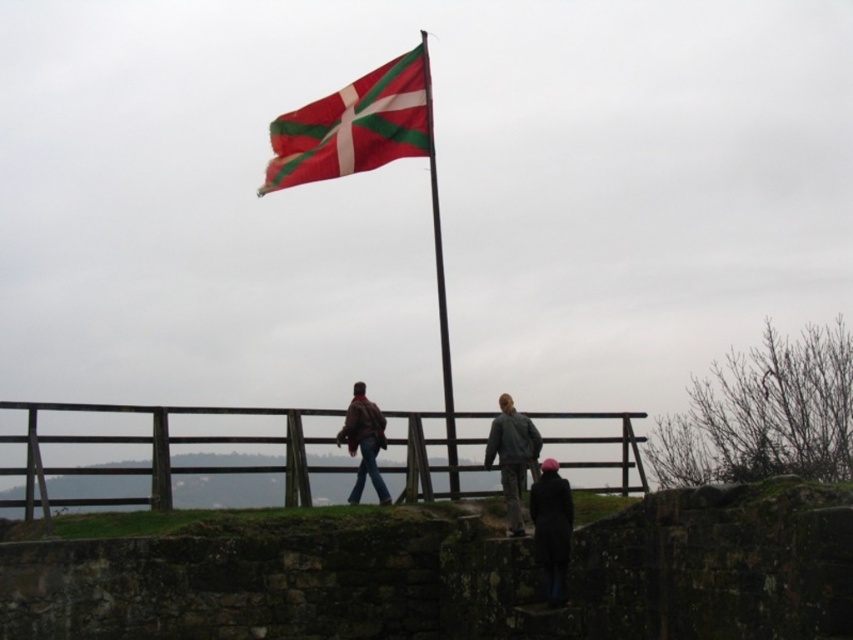
Question: Which is farther from the leather jacket at center?

Choices:
 (A) dark gray jacket at center
 (B) red and white striped flag at upper center

Answer: (B)

Question: Does brown wooden fence at lower center have a lesser width compared to smooth metal pole at center?

Choices:
 (A) yes
 (B) no

Answer: (B)

Question: Does dark gray jacket at lower center have a larger size compared to dark gray jacket at center?

Choices:
 (A) yes
 (B) no

Answer: (B)

Question: Among these objects, which one is nearest to the camera?

Choices:
 (A) dark gray jacket at center
 (B) leather jacket at center

Answer: (A)

Question: Does red and white striped flag at upper center have a larger size compared to smooth metal pole at center?

Choices:
 (A) no
 (B) yes

Answer: (A)

Question: Which object appears farthest from the camera in this image?

Choices:
 (A) brown wooden fence at lower center
 (B) smooth metal pole at center
 (C) leather jacket at center
 (D) dark gray jacket at center

Answer: (B)